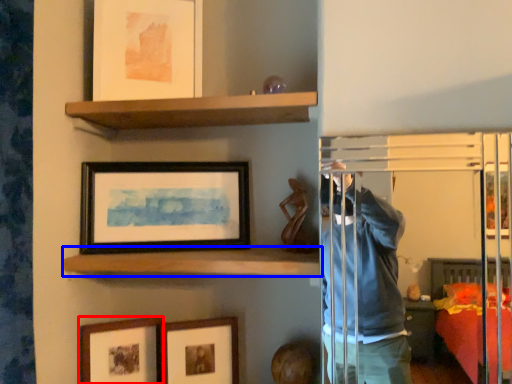
Question: Which object appears farthest to the camera in this image, picture frame (highlighted by a red box) or shelf (highlighted by a blue box)?

Choices:
 (A) picture frame
 (B) shelf

Answer: (A)